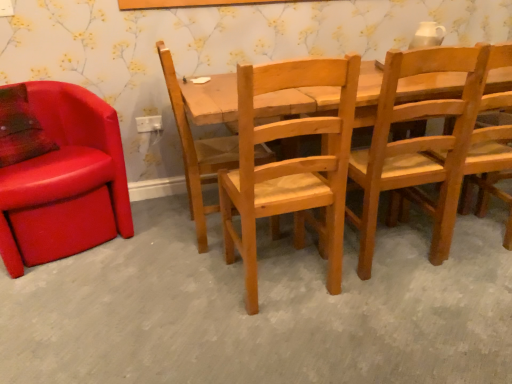
Locate an element on the screen. The width and height of the screenshot is (512, 384). vacant space to the right of leather at left, which is the fifth chair in right-to-left order is located at coordinates (158, 245).